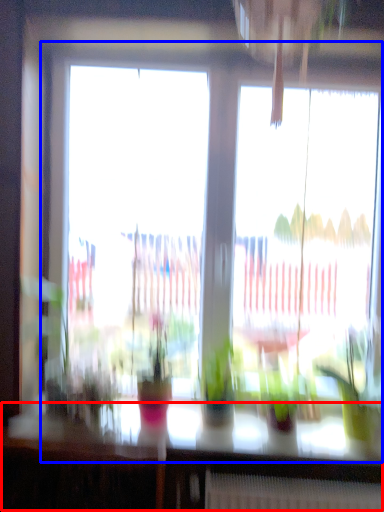
Question: Which of the following is the closest to the observer, table (highlighted by a red box) or window (highlighted by a blue box)?

Choices:
 (A) table
 (B) window

Answer: (A)